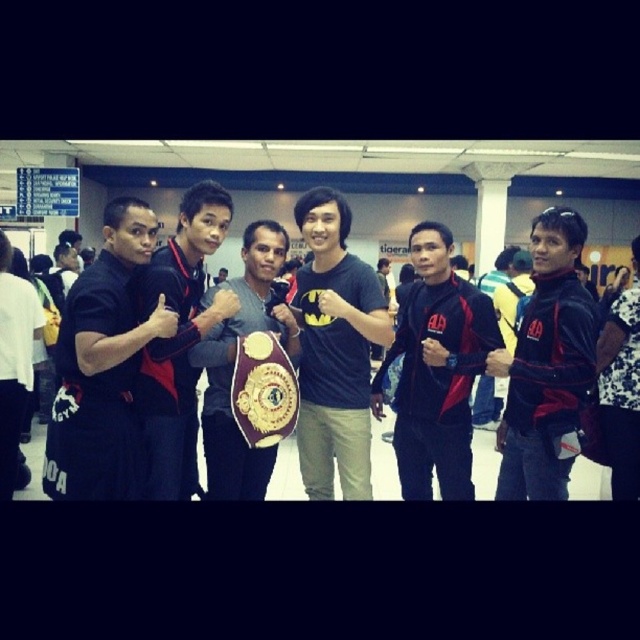
Question: Among these points, which one is farthest from the camera?

Choices:
 (A) (257, 252)
 (B) (637, 368)

Answer: (B)

Question: Does matte black jacket at center have a smaller size compared to matte black shirt at left?

Choices:
 (A) yes
 (B) no

Answer: (A)

Question: Which point appears closest to the camera in this image?

Choices:
 (A) (212, 499)
 (B) (141, 378)
 (C) (618, 308)
 (D) (566, 314)

Answer: (D)

Question: Can you confirm if black matte t-shirt at center is positioned above matte black jacket at right?

Choices:
 (A) yes
 (B) no

Answer: (A)

Question: Which point is farther to the camera?

Choices:
 (A) matte black shirt at center
 (B) white floral shirt at right

Answer: (B)

Question: Is black fabric pants at left thinner than matte black jacket at right?

Choices:
 (A) no
 (B) yes

Answer: (A)